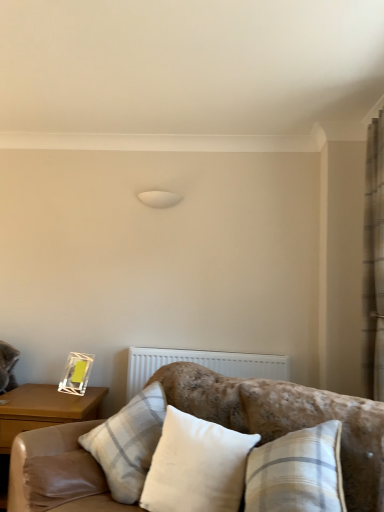
Question: Does beige textured curtain at right have a larger size compared to white cotton pillow at center, which ranks as the 2th pillow in back-to-front order?

Choices:
 (A) yes
 (B) no

Answer: (A)

Question: Does beige textured curtain at right contain white cotton pillow at center, which ranks as the 2th pillow in back-to-front order?

Choices:
 (A) no
 (B) yes

Answer: (A)

Question: Can you confirm if beige textured curtain at right is taller than white cotton pillow at center, which ranks as the 2th pillow in back-to-front order?

Choices:
 (A) yes
 (B) no

Answer: (A)

Question: Can you confirm if beige textured curtain at right is wider than white cotton pillow at center, which ranks as the 1th pillow in front-to-back order?

Choices:
 (A) yes
 (B) no

Answer: (B)

Question: Is the surface of beige textured curtain at right in direct contact with white cotton pillow at center, which ranks as the 1th pillow in front-to-back order?

Choices:
 (A) no
 (B) yes

Answer: (A)

Question: From a real-world perspective, is beige textured curtain at right positioned under white cotton pillow at center, which ranks as the 2th pillow in back-to-front order, based on gravity?

Choices:
 (A) no
 (B) yes

Answer: (A)

Question: Considering the relative sizes of wooden nightstand at left and beige textured curtain at right in the image provided, is wooden nightstand at left smaller than beige textured curtain at right?

Choices:
 (A) no
 (B) yes

Answer: (A)

Question: Is the depth of wooden nightstand at left less than that of beige textured curtain at right?

Choices:
 (A) yes
 (B) no

Answer: (B)

Question: From a real-world perspective, is wooden nightstand at left located higher than beige textured curtain at right?

Choices:
 (A) yes
 (B) no

Answer: (B)

Question: Does wooden nightstand at left have a larger size compared to beige textured curtain at right?

Choices:
 (A) yes
 (B) no

Answer: (A)

Question: From a real-world perspective, is wooden nightstand at left physically below beige textured curtain at right?

Choices:
 (A) yes
 (B) no

Answer: (A)

Question: Is wooden nightstand at left to the left of beige textured curtain at right from the viewer's perspective?

Choices:
 (A) no
 (B) yes

Answer: (B)

Question: Does white cotton pillow at center, which ranks as the 1th pillow in front-to-back order, have a lesser height compared to velvet beige couch at lower center?

Choices:
 (A) no
 (B) yes

Answer: (B)